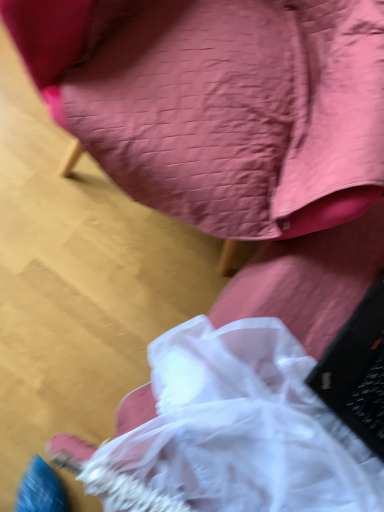
Measure the distance between matte pink fabric chair at upper center and camera.

A distance of 26.83 inches exists between matte pink fabric chair at upper center and camera.

Image resolution: width=384 pixels, height=512 pixels. What do you see at coordinates (220, 103) in the screenshot? I see `matte pink fabric chair at upper center` at bounding box center [220, 103].

The height and width of the screenshot is (512, 384). What are the coordinates of `matte pink fabric chair at upper center` in the screenshot? It's located at (220, 103).

Where is `black matte laptop at lower right`? The height and width of the screenshot is (512, 384). black matte laptop at lower right is located at coordinates (357, 371).

What is the approximate height of black matte laptop at lower right?

black matte laptop at lower right is 9.76 inches tall.

The width and height of the screenshot is (384, 512). Describe the element at coordinates (357, 371) in the screenshot. I see `black matte laptop at lower right` at that location.

Locate an element on the screen. The height and width of the screenshot is (512, 384). matte pink fabric chair at upper center is located at coordinates pyautogui.click(x=220, y=103).

Considering the positions of objects black matte laptop at lower right and matte pink fabric chair at upper center in the image provided, who is more to the right, black matte laptop at lower right or matte pink fabric chair at upper center?

Positioned to the right is black matte laptop at lower right.

Which object is closer to the camera, black matte laptop at lower right or matte pink fabric chair at upper center?

matte pink fabric chair at upper center is in front.

Which point is more forward, (322, 377) or (166, 117)?

Positioned in front is point (322, 377).

Consider the image. From the image's perspective, relative to matte pink fabric chair at upper center, is black matte laptop at lower right above or below?

black matte laptop at lower right is below matte pink fabric chair at upper center.

From a real-world perspective, is black matte laptop at lower right below matte pink fabric chair at upper center?

Correct, in the physical world, black matte laptop at lower right is lower than matte pink fabric chair at upper center.

Can you confirm if black matte laptop at lower right is thinner than matte pink fabric chair at upper center?

Yes, black matte laptop at lower right is thinner than matte pink fabric chair at upper center.

Between black matte laptop at lower right and matte pink fabric chair at upper center, which one has less height?

With less height is black matte laptop at lower right.

Can you confirm if black matte laptop at lower right is smaller than matte pink fabric chair at upper center?

Yes, black matte laptop at lower right is smaller than matte pink fabric chair at upper center.

Is matte pink fabric chair at upper center a part of black matte laptop at lower right?

No, matte pink fabric chair at upper center is not surrounded by black matte laptop at lower right.

Is black matte laptop at lower right next to matte pink fabric chair at upper center?

No, black matte laptop at lower right is not making contact with matte pink fabric chair at upper center.

Is black matte laptop at lower right facing towards matte pink fabric chair at upper center?

Yes, black matte laptop at lower right is aimed at matte pink fabric chair at upper center.

How different are the orientations of black matte laptop at lower right and matte pink fabric chair at upper center in degrees?

They differ by 101 degrees in their facing directions.

Measure the distance between black matte laptop at lower right and matte pink fabric chair at upper center.

black matte laptop at lower right and matte pink fabric chair at upper center are 18.91 inches apart.

This screenshot has height=512, width=384. What are the coordinates of `laptop on the right of matte pink fabric chair at upper center` in the screenshot? It's located at (357, 371).

Visually, is matte pink fabric chair at upper center positioned to the left or to the right of black matte laptop at lower right?

From the image, it's evident that matte pink fabric chair at upper center is to the left of black matte laptop at lower right.

Relative to black matte laptop at lower right, is matte pink fabric chair at upper center in front or behind?

Visually, matte pink fabric chair at upper center is located in front of black matte laptop at lower right.

Looking at this image, which point is more distant from viewer, (218, 211) or (376, 360)?

Point (218, 211)

From the image's perspective, which is above, matte pink fabric chair at upper center or black matte laptop at lower right?

matte pink fabric chair at upper center is shown above in the image.

From the picture: From a real-world perspective, is matte pink fabric chair at upper center on top of black matte laptop at lower right?

Yes, from a real-world perspective, matte pink fabric chair at upper center is on top of black matte laptop at lower right.

Between matte pink fabric chair at upper center and black matte laptop at lower right, which one has smaller width?

Thinner between the two is black matte laptop at lower right.

Considering the sizes of objects matte pink fabric chair at upper center and black matte laptop at lower right in the image provided, who is taller, matte pink fabric chair at upper center or black matte laptop at lower right?

matte pink fabric chair at upper center is taller.

Between matte pink fabric chair at upper center and black matte laptop at lower right, which one has smaller size?

black matte laptop at lower right.

Would you say black matte laptop at lower right is part of matte pink fabric chair at upper center's contents?

Actually, black matte laptop at lower right is outside matte pink fabric chair at upper center.

Are matte pink fabric chair at upper center and black matte laptop at lower right far apart?

matte pink fabric chair at upper center is near black matte laptop at lower right, not far away.

Is matte pink fabric chair at upper center turned away from black matte laptop at lower right?

That's not correct — matte pink fabric chair at upper center is not looking away from black matte laptop at lower right.

This screenshot has width=384, height=512. Find the location of `laptop below the matte pink fabric chair at upper center (from the image's perspective)`. laptop below the matte pink fabric chair at upper center (from the image's perspective) is located at coordinates (357, 371).

What are the coordinates of `laptop lying on the right of matte pink fabric chair at upper center` in the screenshot? It's located at (357, 371).

I want to click on chair above the black matte laptop at lower right (from a real-world perspective), so click(x=220, y=103).